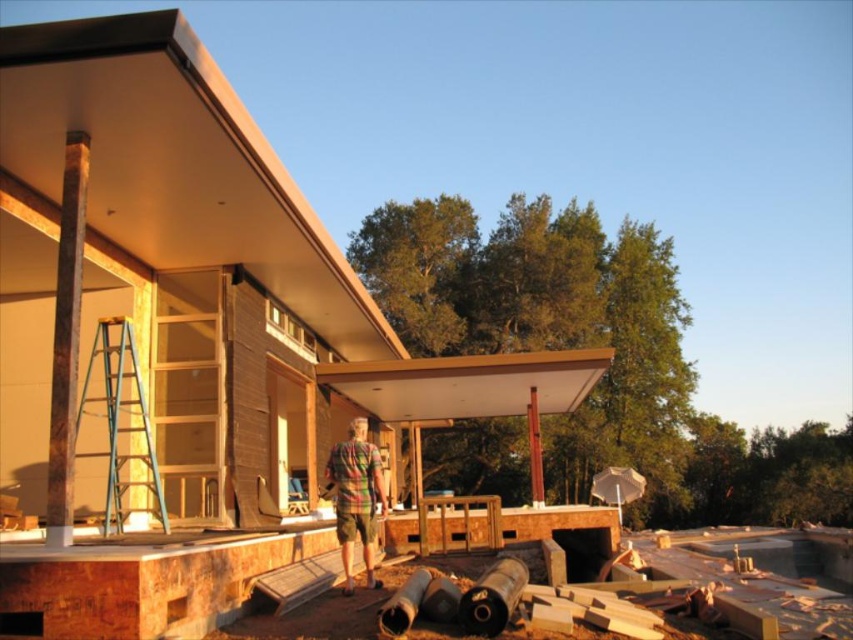
You are standing at the point marked by the blue ladder at left represented by point (120,420). You want to walk towards the house. Is there a clear path? The ground around you is uneven and scattered with construction materials, including rolls of pipe, wooden planks, and other debris.

The path towards the house from the blue ladder at left represented by point (120,420) is blocked by construction materials such as rolls of pipe, wooden planks, and debris, so the path is not clear.